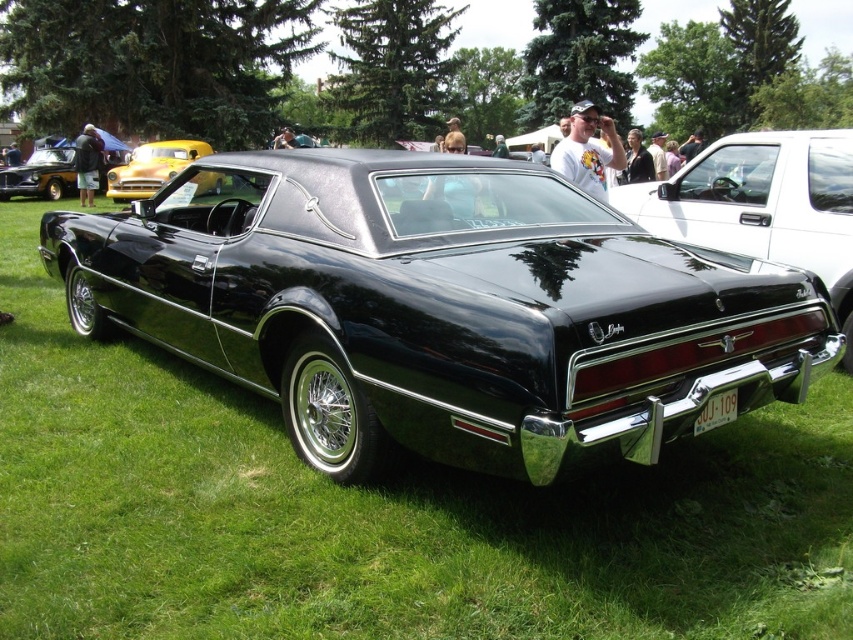
You are a photographer at a car show. You want to take a photo of the glossy black muscle car at center and the glossy black car at center. Which one is closer to the front of the image?

The glossy black muscle car at center is positioned over the glossy black car at center, so the glossy black muscle car at center is closer to the front.

You are a photographer at the car show and need to frame a shot that includes both the glossy black car at center and the yellow glossy car at upper left. Given their widths, which car should be placed closer to the edge of the frame to avoid overcrowding?

The glossy black car at center has a smaller width than the yellow glossy car at upper left, so to avoid overcrowding, the yellow glossy car at upper left should be placed closer to the edge of the frame since it is wider.

You are a photographer at a car show. You want to capture a photo of the glossy black car at center and the yellow glossy car at upper left in the same frame. Based on their positions, which car should you focus on first to ensure both are in the shot?

The glossy black car at center is located below the yellow glossy car at upper left, so you should focus on the yellow glossy car at upper left first to ensure both are in the shot.